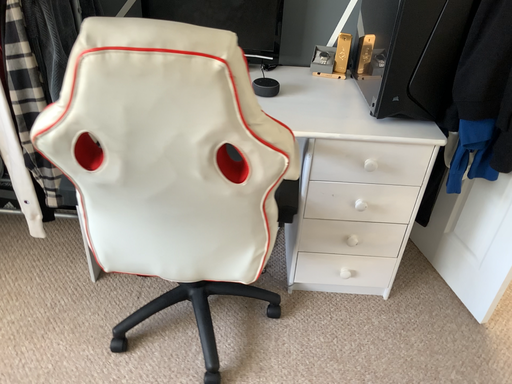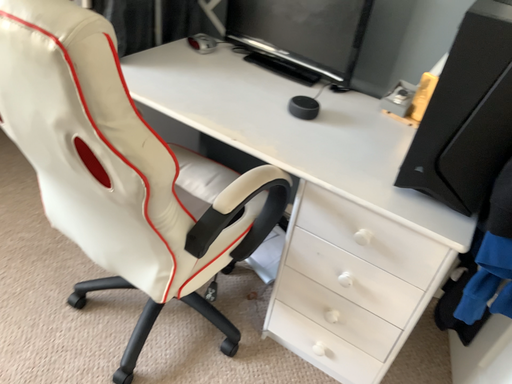
Question: How did the camera likely rotate when shooting the video?

Choices:
 (A) rotated left
 (B) rotated right

Answer: (A)